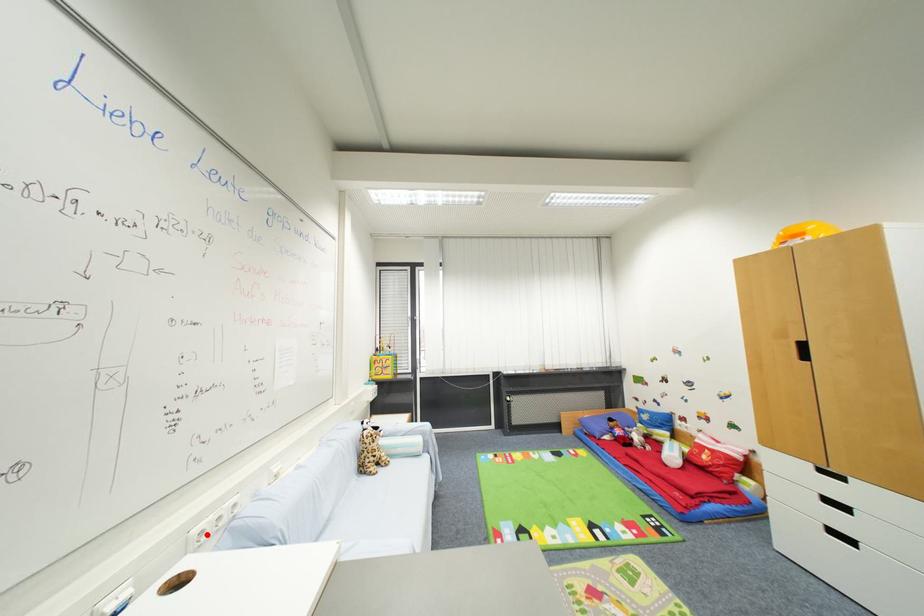
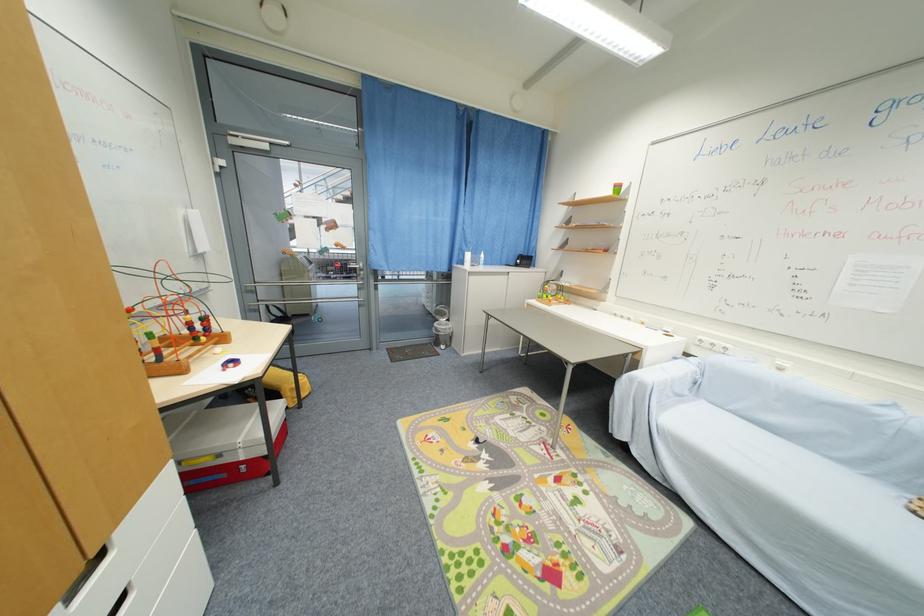
In the second image, find the point that corresponds to the highlighted location in the first image.

(706, 342)